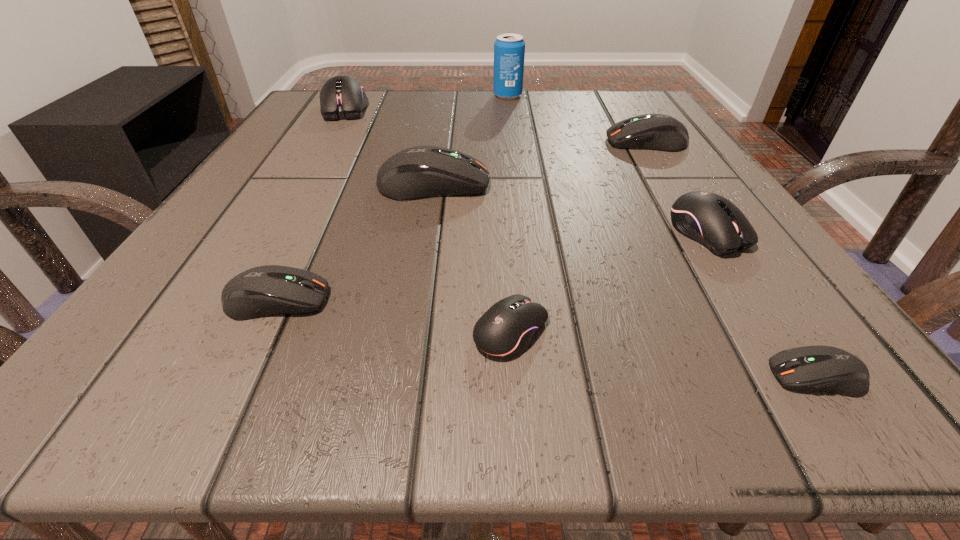
The width and height of the screenshot is (960, 540). Find the location of `free space located 0.060m on the button of the second biggest dark computer equipment`. free space located 0.060m on the button of the second biggest dark computer equipment is located at coordinates [574, 142].

I want to click on free space located 0.200m on the button of the second biggest dark computer equipment, so click(499, 142).

Find the location of a particular element. Image resolution: width=960 pixels, height=540 pixels. free point located 0.100m on the back of the fifth farthest object is located at coordinates (x=671, y=174).

Locate an element on the screen. The width and height of the screenshot is (960, 540). free space located on the button of the leftmost dark computer equipment is located at coordinates (628, 300).

Locate an element on the screen. Image resolution: width=960 pixels, height=540 pixels. vacant space located on the right of the smallest black computer mouse is located at coordinates (806, 330).

Locate an element on the screen. free space located on the button of the shortest object is located at coordinates (610, 376).

This screenshot has height=540, width=960. I want to click on free spot located on the button of the shortest object, so click(x=549, y=376).

In order to click on free point located 0.050m on the button of the shortest object in this screenshot , I will do `click(721, 376)`.

The image size is (960, 540). What are the coordinates of `soda can present at the far edge` in the screenshot? It's located at (509, 49).

The image size is (960, 540). I want to click on object situated at the far left corner, so click(x=341, y=97).